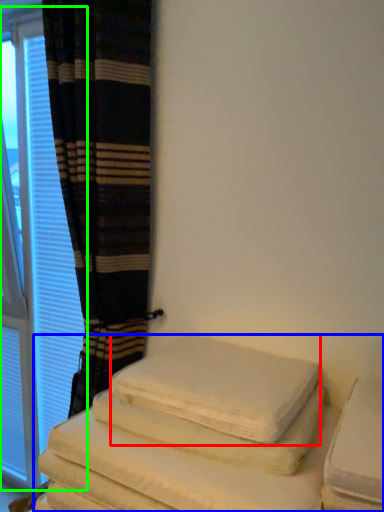
Question: Which object is positioned farthest from bath towel (highlighted by a red box)? Select from furniture (highlighted by a blue box) and window (highlighted by a green box).

Choices:
 (A) furniture
 (B) window

Answer: (B)